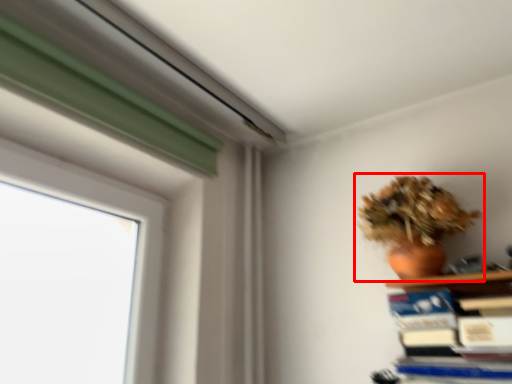
Question: From the image's perspective, what is the correct spatial relationship of houseplant (annotated by the red box) in relation to paperback book?

Choices:
 (A) below
 (B) above

Answer: (B)